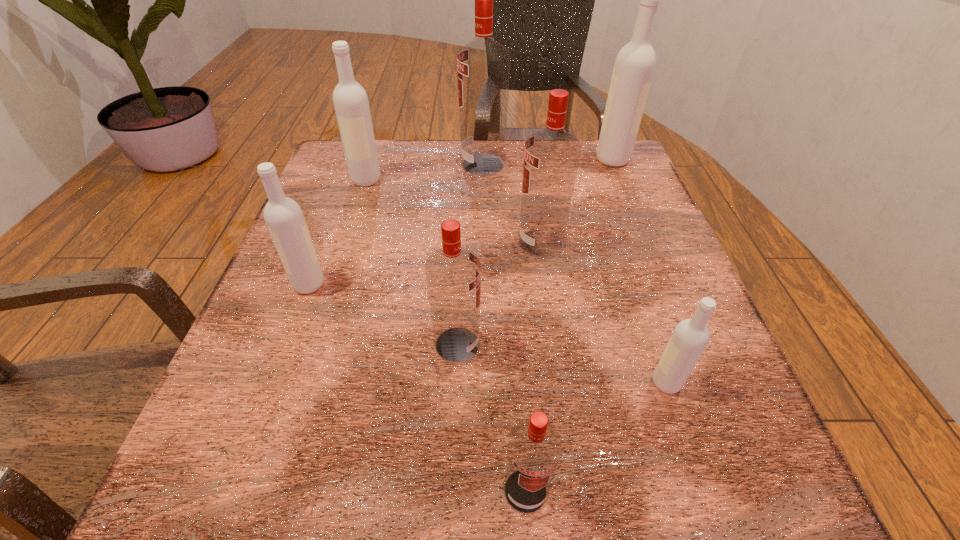
In order to click on vacant space located 0.210m on the right of the second biggest white vodka in this screenshot , I will do click(471, 180).

Find the location of a particular element. vacant space located 0.050m on the back of the fifth farthest vodka is located at coordinates (321, 254).

The width and height of the screenshot is (960, 540). In order to click on vacant space situated 0.160m on the front label of the second smallest red vodka in this screenshot , I will do `click(582, 345)`.

Locate an element on the screen. This screenshot has width=960, height=540. vacant space located 0.370m on the left of the second nearest vodka is located at coordinates (400, 383).

Identify the location of object that is at the near edge. The image size is (960, 540). (534, 448).

Locate an element on the screen. object present at the far left corner is located at coordinates (350, 100).

Image resolution: width=960 pixels, height=540 pixels. I want to click on object positioned at the far right corner, so pos(634,66).

Where is `free space at the far edge`? free space at the far edge is located at coordinates (509, 146).

Where is `free space at the left edge of the desktop`? Image resolution: width=960 pixels, height=540 pixels. free space at the left edge of the desktop is located at coordinates (363, 280).

In the image, there is a desktop. Where is `vacant space at the right edge`? Image resolution: width=960 pixels, height=540 pixels. vacant space at the right edge is located at coordinates (613, 280).